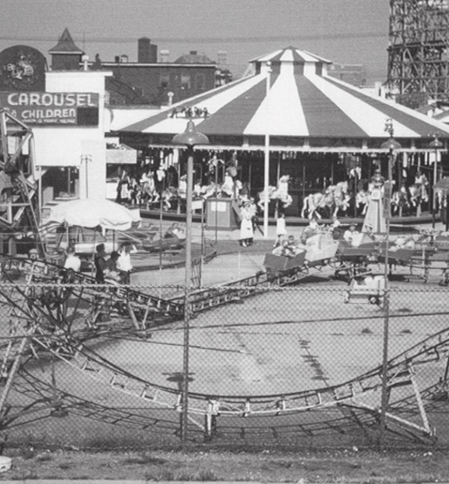
Image resolution: width=449 pixels, height=484 pixels. I want to click on light, so click(195, 141), click(387, 146).